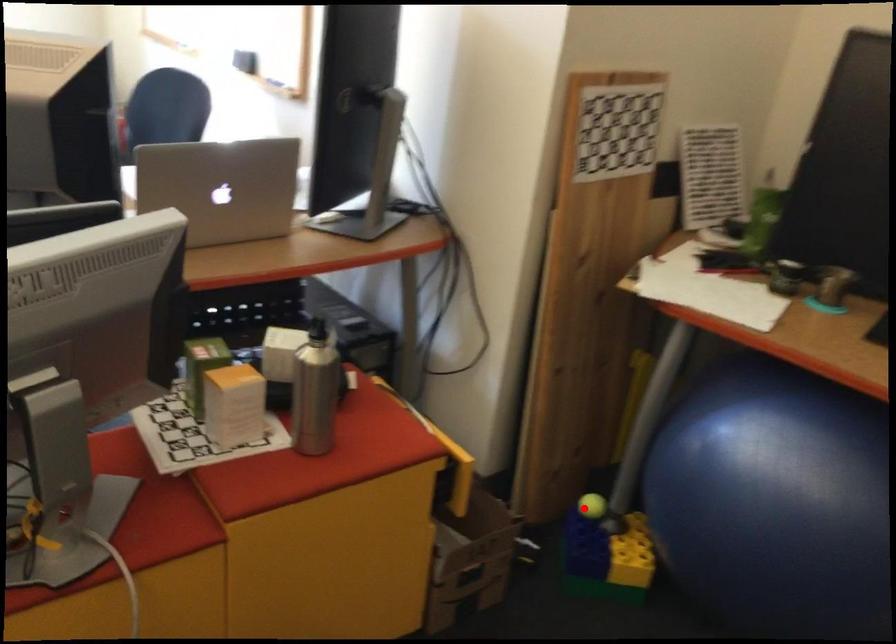
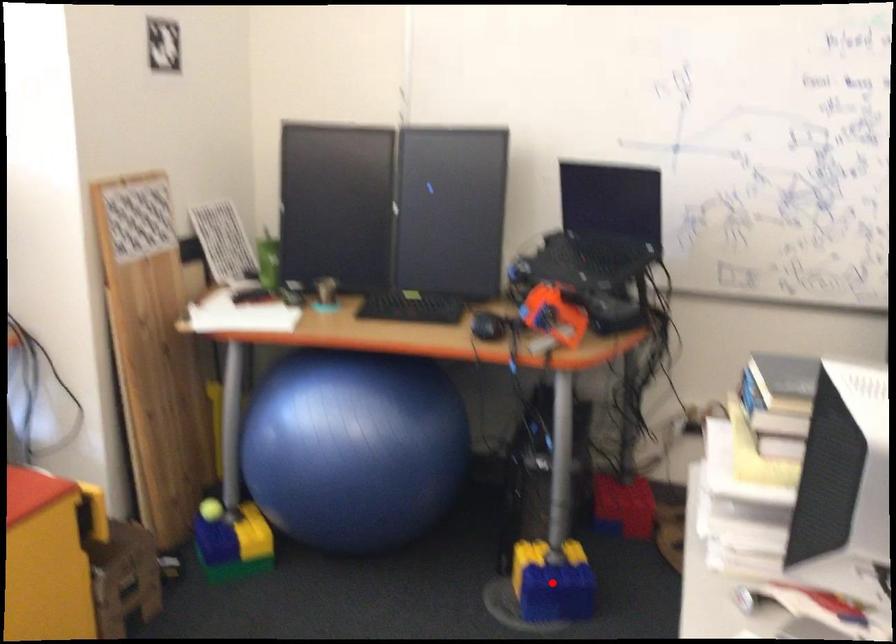
I am providing you with two images of the same scene from different viewpoints. A red point is marked on the first image and another point is marked on the second image. Does the point marked in image1 correspond to the same location as the one in image2?

No